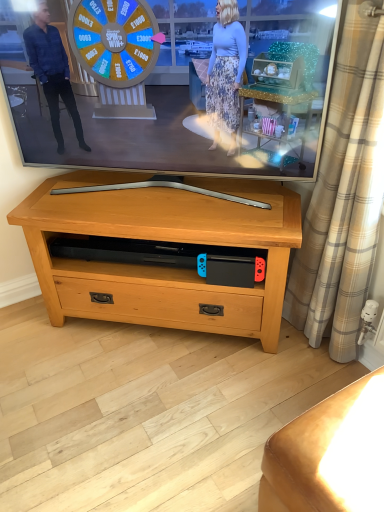
Identify the location of free space in front of pine wood tv stand at center. (158, 409).